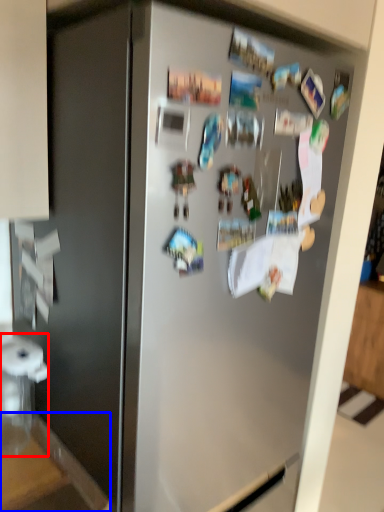
Question: Which of the following is the closest to the observer, appliance (highlighted by a red box) or counter top (highlighted by a blue box)?

Choices:
 (A) appliance
 (B) counter top

Answer: (B)